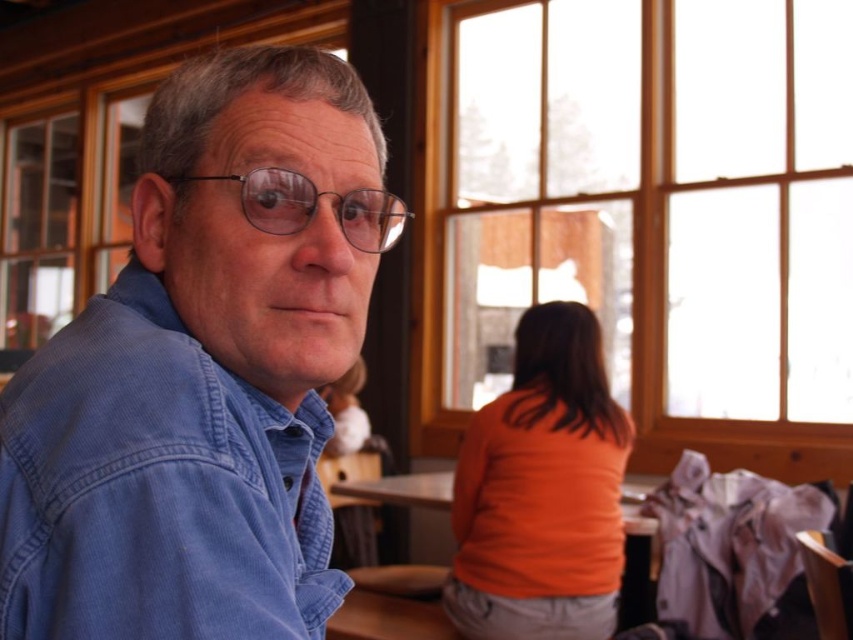
Question: Can you confirm if denim shirt at left is positioned to the right of clear plastic glasses at center?

Choices:
 (A) no
 (B) yes

Answer: (A)

Question: Which point appears farthest from the camera in this image?

Choices:
 (A) (376, 224)
 (B) (431, 620)
 (C) (136, 596)
 (D) (697, 227)

Answer: (D)

Question: Which object appears farthest from the camera in this image?

Choices:
 (A) clear plastic glasses at center
 (B) smooth wooden table at center

Answer: (B)

Question: Does denim shirt at left come in front of smooth wooden table at center?

Choices:
 (A) no
 (B) yes

Answer: (B)

Question: Considering the relative positions of smooth wooden table at center and clear plastic glasses at center in the image provided, where is smooth wooden table at center located with respect to clear plastic glasses at center?

Choices:
 (A) below
 (B) above

Answer: (A)

Question: Among these objects, which one is nearest to the camera?

Choices:
 (A) smooth wooden table at center
 (B) wooden frame at upper right
 (C) denim shirt at left

Answer: (C)